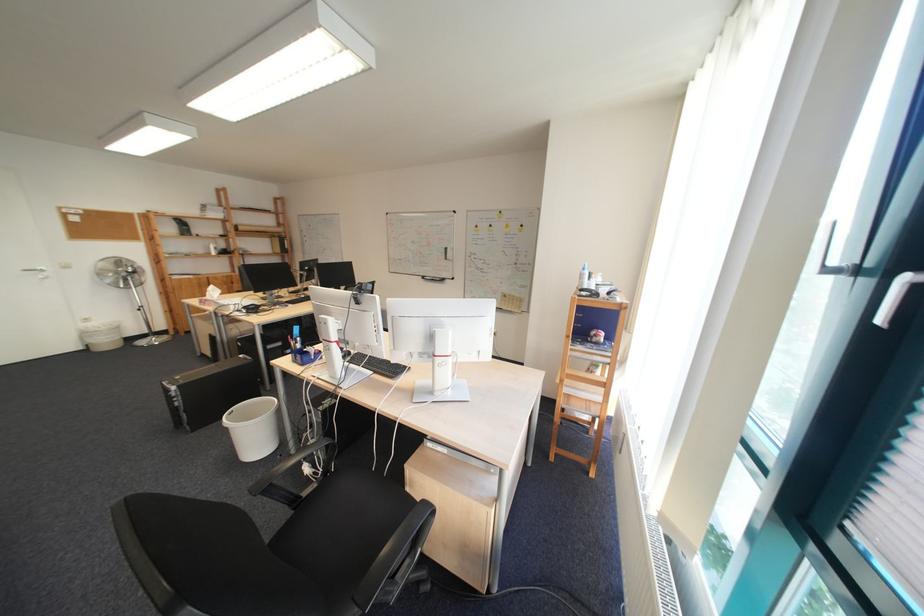
Where is `black chair sitting surface`? black chair sitting surface is located at coordinates (349, 525).